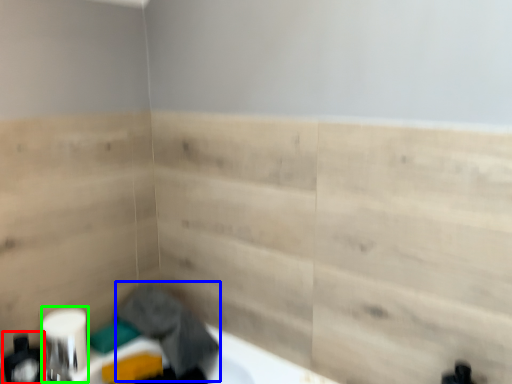
Question: Estimate the real-world distances between objects in this image. Which object is farther from toiletry (highlighted by a red box), laundry (highlighted by a blue box) or toilet paper (highlighted by a green box)?

Choices:
 (A) laundry
 (B) toilet paper

Answer: (A)